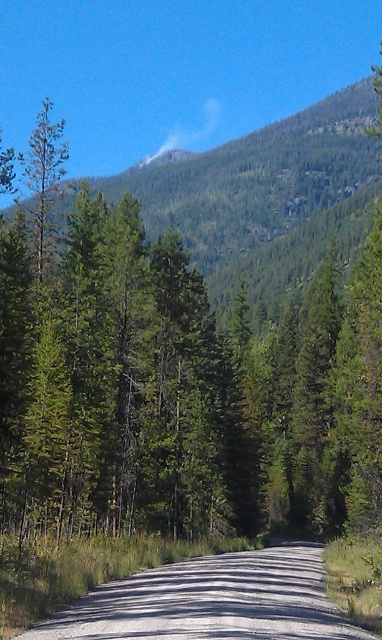
Question: Which object appears farthest from the camera in this image?

Choices:
 (A) green forested mountain at upper center
 (B) gray gravel road at center

Answer: (A)

Question: Can you confirm if green forested mountain at upper center is positioned above gray gravel road at center?

Choices:
 (A) no
 (B) yes

Answer: (B)

Question: Which of the following is the farthest from the observer?

Choices:
 (A) (95, 602)
 (B) (213, 172)

Answer: (B)

Question: Is green forested mountain at upper center behind gray gravel road at center?

Choices:
 (A) yes
 (B) no

Answer: (A)

Question: Is green forested mountain at upper center bigger than gray gravel road at center?

Choices:
 (A) yes
 (B) no

Answer: (A)